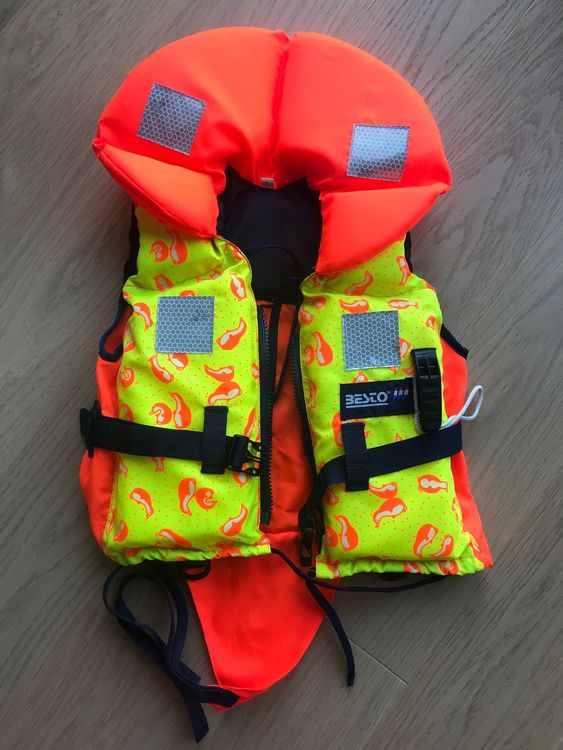
This screenshot has height=750, width=563. I want to click on floor, so click(x=504, y=238).